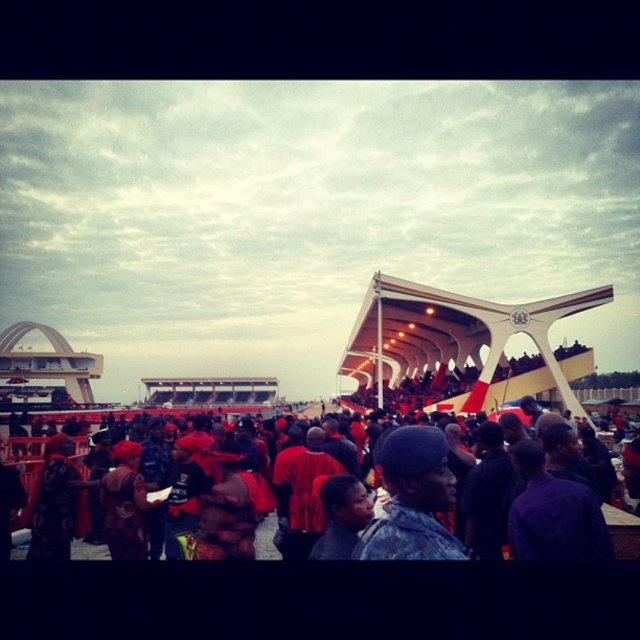
Is camouflage uniform at center in front of red fabric clothing at lower center?

Yes, it is in front of red fabric clothing at lower center.

Does camouflage uniform at center have a smaller size compared to red fabric clothing at lower center?

Indeed, camouflage uniform at center has a smaller size compared to red fabric clothing at lower center.

Does point (426, 493) lie behind point (12, 554)?

No, it is not.

Find the location of a particular element. The height and width of the screenshot is (640, 640). camouflage uniform at center is located at coordinates pyautogui.click(x=412, y=499).